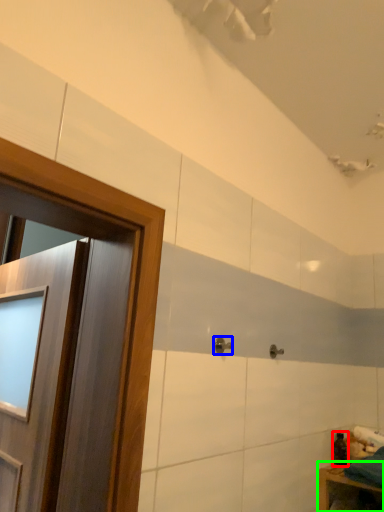
Question: Considering the real-world distances, which object is farthest from toiletry (highlighted by a red box)? door handle (highlighted by a blue box) or furniture (highlighted by a green box)?

Choices:
 (A) door handle
 (B) furniture

Answer: (A)